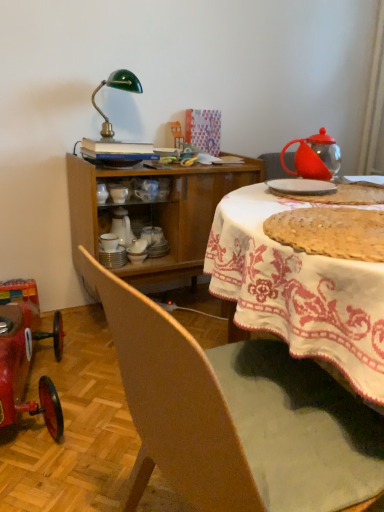
What are the coordinates of `empty space that is ontop of white ceramic plate at upper center, arranged as the 4th tableware when viewed from the back (from a real-world perspective)` in the screenshot? It's located at (306, 180).